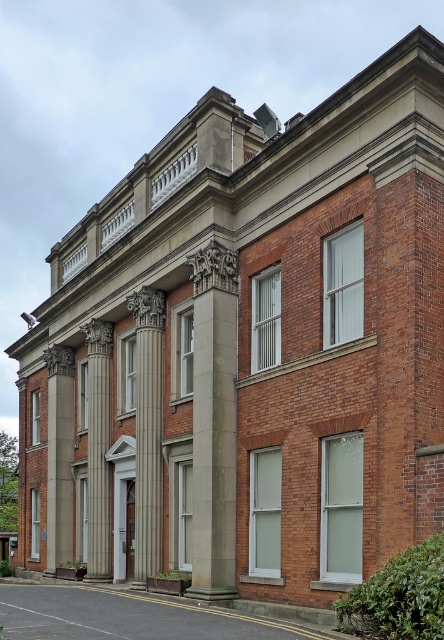
Is gray stone column at center shorter than white marble column at center?

No, gray stone column at center is not shorter than white marble column at center.

Based on the photo, is gray stone column at center in front of white marble column at center?

Yes.

Between point (222, 401) and point (159, 417), which one is positioned in front?

Point (222, 401)

Where is `gray stone column at center`? gray stone column at center is located at coordinates (214, 422).

Does point (221, 346) come behind point (106, 444)?

No, it is in front of (106, 444).

How distant is gray stone column at center from polished stone column at left?

gray stone column at center is 7.25 meters away from polished stone column at left.

The width and height of the screenshot is (444, 640). What are the coordinates of `gray stone column at center` in the screenshot? It's located at (214, 422).

Who is taller, white marble column at center or polished stone column at left?

Standing taller between the two is white marble column at center.

Locate an element on the screen. The image size is (444, 640). white marble column at center is located at coordinates (149, 429).